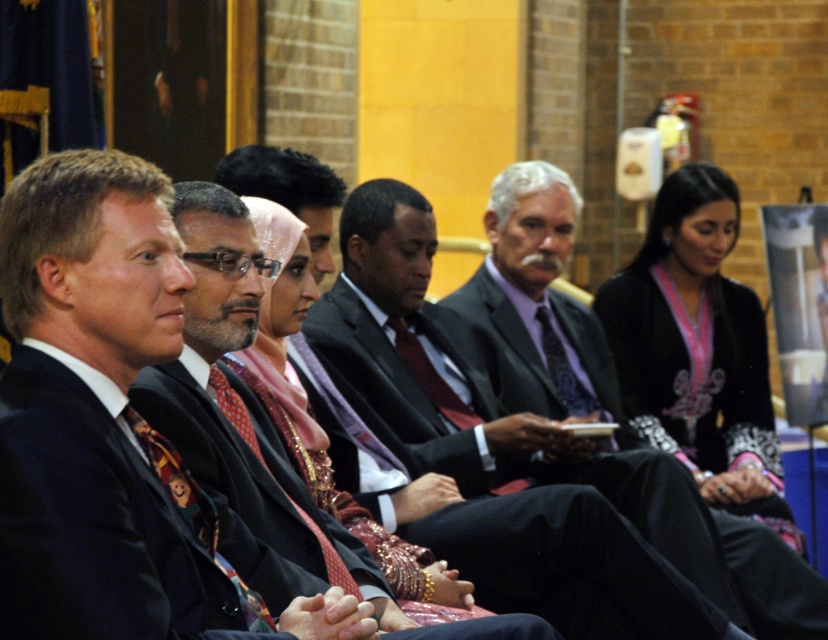
Question: Which object is the farthest from the black satin suit at center?

Choices:
 (A) dark gray suit at center
 (B) matte black suit at center

Answer: (A)

Question: Which object is positioned farthest from the dark gray suit at center?

Choices:
 (A) black satin suit at center
 (B) matte black suit at center
 (C) purple satin suit at center

Answer: (A)

Question: Is purple satin suit at center to the right of dark gray suit at center from the viewer's perspective?

Choices:
 (A) yes
 (B) no

Answer: (A)

Question: Which point is farther to the camera?

Choices:
 (A) black satin suit at center
 (B) dark gray suit at center

Answer: (B)

Question: Is purple satin suit at center to the left of dark gray suit at center from the viewer's perspective?

Choices:
 (A) no
 (B) yes

Answer: (A)

Question: Is dark gray suit at center positioned at the back of matte black suit at center?

Choices:
 (A) no
 (B) yes

Answer: (B)